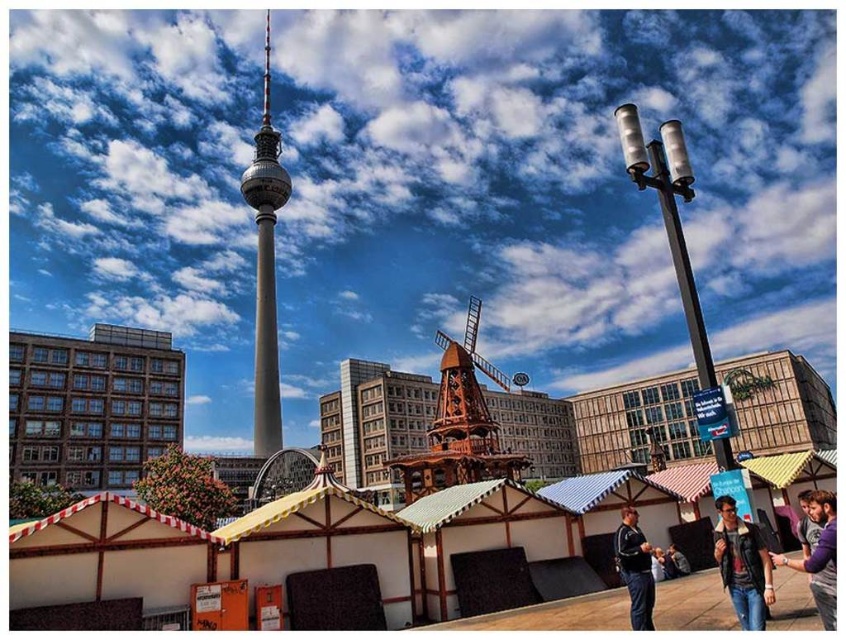
You are standing at the entrance of the market stalls and want to take a photo of the wooden windmill at center. Which direction should you face to capture it in your shot?

The wooden windmill at center is located at point (460, 422), so you should face towards the center of the image to capture it in your photo.

You are standing at the point marked as point (460, 422). What object is located exactly at that point?

The wooden windmill at center is located exactly at point (460, 422).

You are a visitor standing at the base of the wooden windmill at center and want to take a photo of the beige fabric jacket at lower right. Since the jacket is small, you want to make sure it fills the frame. Should you zoom in or zoom out your camera?

The wooden windmill at center is much taller than the beige fabric jacket at lower right. To make the beige fabric jacket at lower right fill the frame, you should zoom in to focus on it.